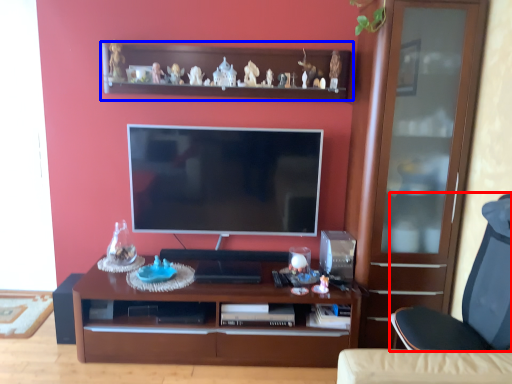
Question: Which object is closer to the camera taking this photo, chair (highlighted by a red box) or shelf (highlighted by a blue box)?

Choices:
 (A) chair
 (B) shelf

Answer: (A)